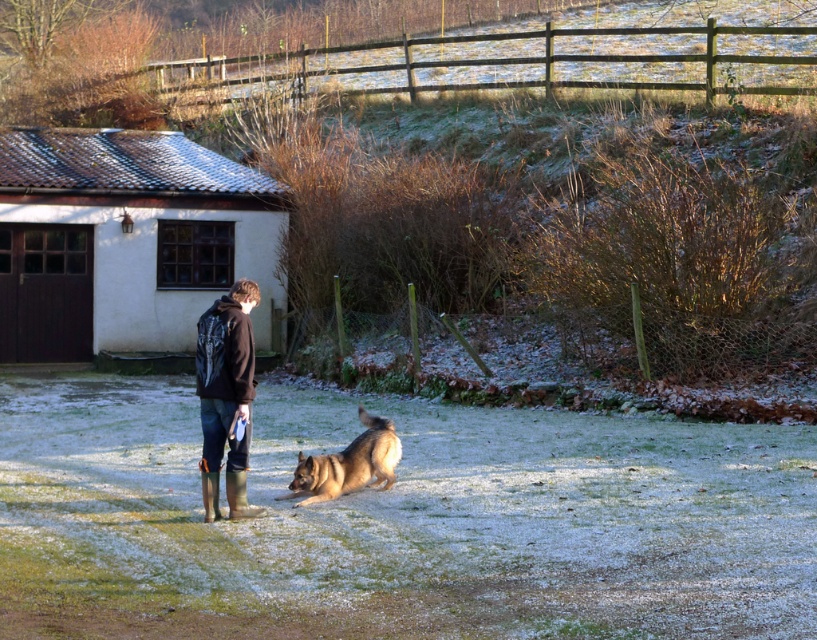
Question: Can you confirm if rubber boots at center is bigger than golden brown fur dog at center?

Choices:
 (A) yes
 (B) no

Answer: (B)

Question: Can you confirm if rubber boots at center is positioned to the right of golden brown fur dog at center?

Choices:
 (A) yes
 (B) no

Answer: (B)

Question: Which point is farther to the camera?

Choices:
 (A) (239, 392)
 (B) (304, 467)

Answer: (B)

Question: Which of the following is the farthest from the observer?

Choices:
 (A) (222, 342)
 (B) (347, 470)

Answer: (B)

Question: Does rubber boots at center come behind golden brown fur dog at center?

Choices:
 (A) yes
 (B) no

Answer: (B)